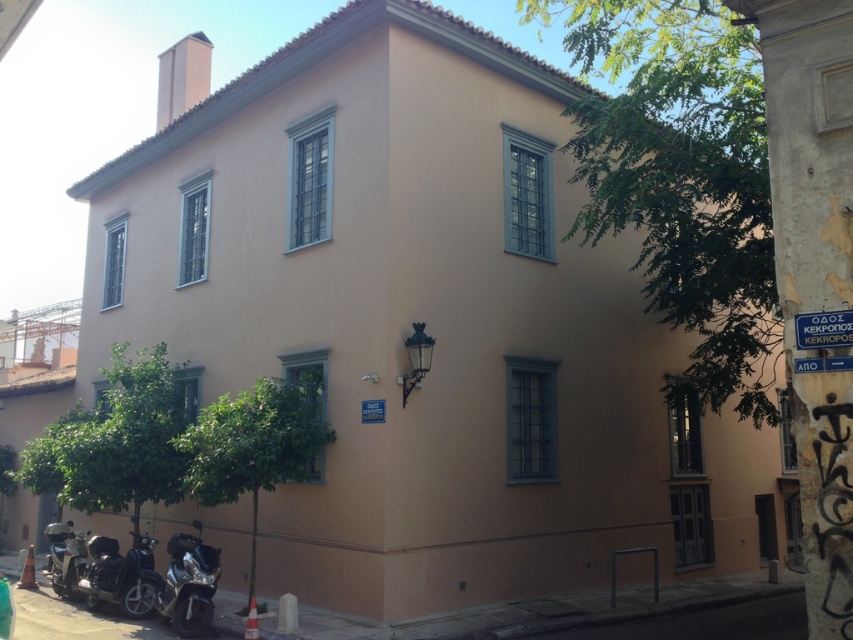
Is shiny chrome motorcycle at lower left to the right of shiny silver motorcycle at lower left from the viewer's perspective?

Indeed, shiny chrome motorcycle at lower left is positioned on the right side of shiny silver motorcycle at lower left.

Does shiny chrome motorcycle at lower left have a greater width compared to shiny silver motorcycle at lower left?

Yes.

Identify the location of shiny chrome motorcycle at lower left. (120, 576).

Image resolution: width=853 pixels, height=640 pixels. I want to click on shiny chrome motorcycle at lower left, so click(120, 576).

The width and height of the screenshot is (853, 640). What do you see at coordinates (120, 576) in the screenshot?
I see `shiny chrome motorcycle at lower left` at bounding box center [120, 576].

Can you confirm if shiny chrome motorcycle at lower left is wider than shiny black motorcycle at lower left?

Yes, shiny chrome motorcycle at lower left is wider than shiny black motorcycle at lower left.

Between point (125, 600) and point (184, 588), which one is positioned in front?

Point (184, 588) is in front.

Find the location of a particular element. shiny chrome motorcycle at lower left is located at coordinates (120, 576).

Consider the image. Is shiny black motorcycle at lower left further to the viewer compared to shiny silver motorcycle at lower left?

No, shiny black motorcycle at lower left is closer to the viewer.

Is shiny black motorcycle at lower left wider than shiny silver motorcycle at lower left?

Incorrect, shiny black motorcycle at lower left's width does not surpass shiny silver motorcycle at lower left's.

Who is more forward, (196, 612) or (68, 592)?

Point (196, 612)

I want to click on shiny black motorcycle at lower left, so click(189, 582).